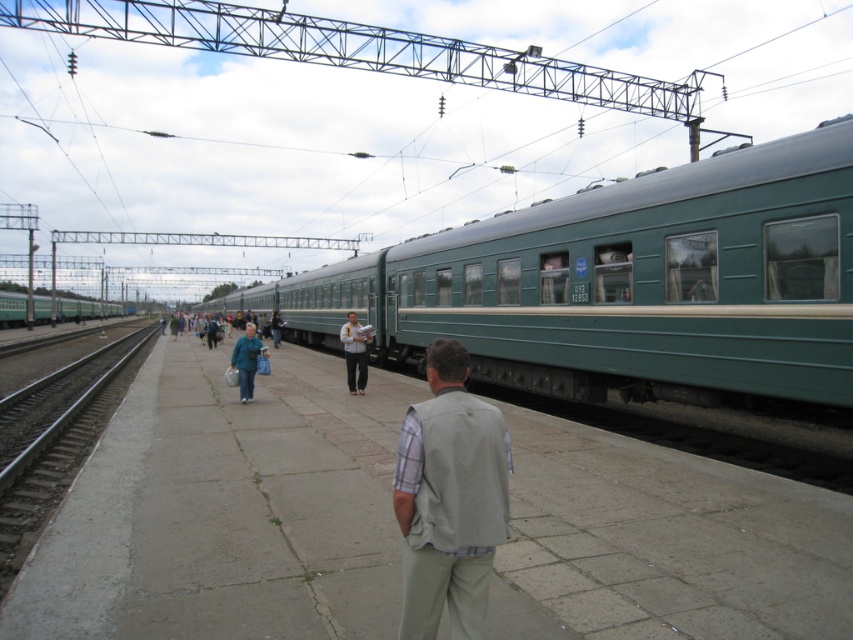
Is green matte train at left above teal fabric jacket at center?

Correct, green matte train at left is located above teal fabric jacket at center.

Is green matte train at left positioned at the back of teal fabric jacket at center?

Yes, it is behind teal fabric jacket at center.

The width and height of the screenshot is (853, 640). What do you see at coordinates (12, 308) in the screenshot?
I see `green matte train at left` at bounding box center [12, 308].

The width and height of the screenshot is (853, 640). I want to click on green matte train at left, so click(x=12, y=308).

From the picture: Which is above, green matte train at center or blue denim jacket at center?

green matte train at center

Can you confirm if green matte train at center is thinner than blue denim jacket at center?

In fact, green matte train at center might be wider than blue denim jacket at center.

Where is `green matte train at center`? The width and height of the screenshot is (853, 640). green matte train at center is located at coordinates (624, 284).

Does green matte train at center have a greater width compared to teal fabric jacket at center?

Indeed, green matte train at center has a greater width compared to teal fabric jacket at center.

Measure the distance from green matte train at center to teal fabric jacket at center.

green matte train at center and teal fabric jacket at center are 12.87 meters apart.

Describe the element at coordinates (624, 284) in the screenshot. This screenshot has height=640, width=853. I see `green matte train at center` at that location.

Identify the location of green matte train at center. The image size is (853, 640). (624, 284).